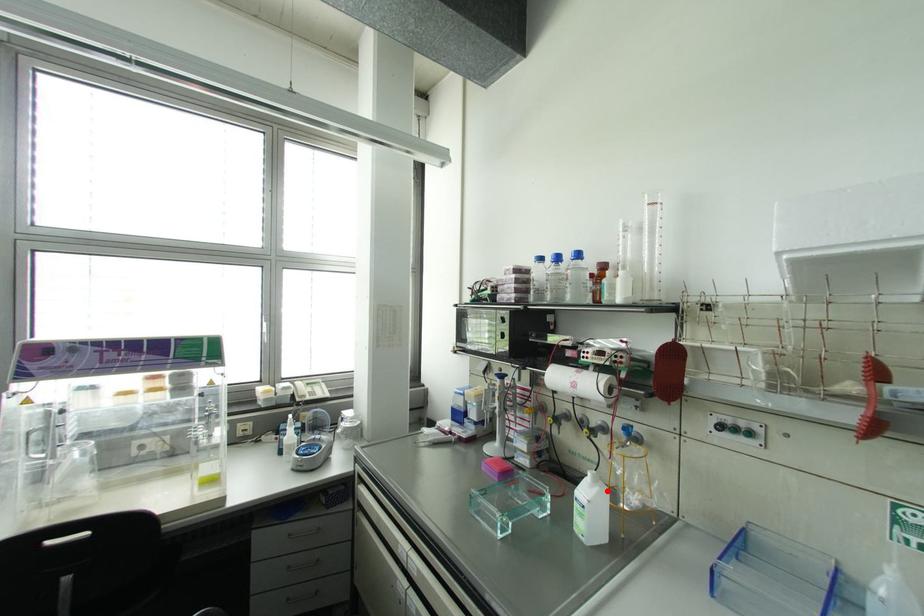
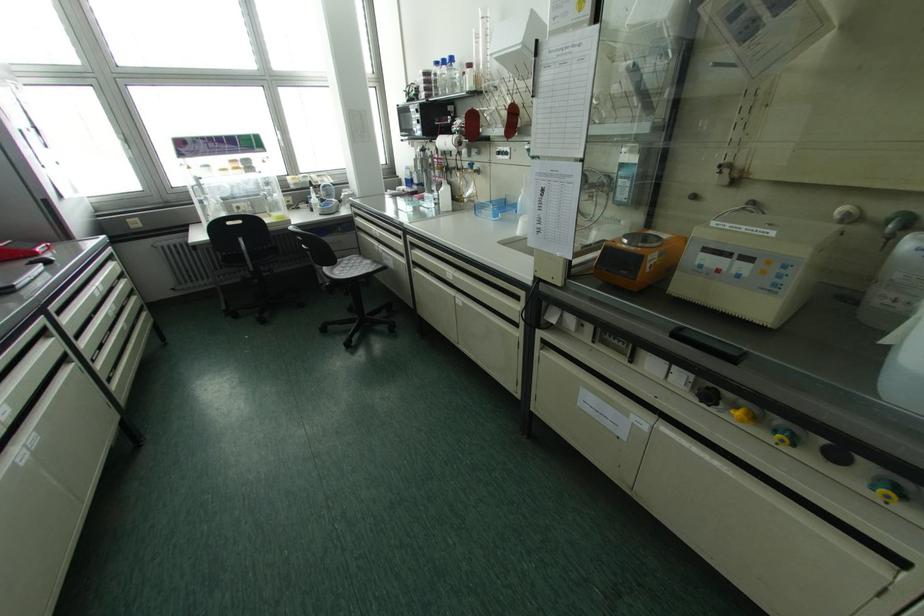
Question: I am providing you with two images of the same scene from different viewpoints. Given a red point in image1, look at the same physical point in image2. Is it:

Choices:
 (A) Closer to the viewpoint
 (B) Farther from the viewpoint

Answer: (A)